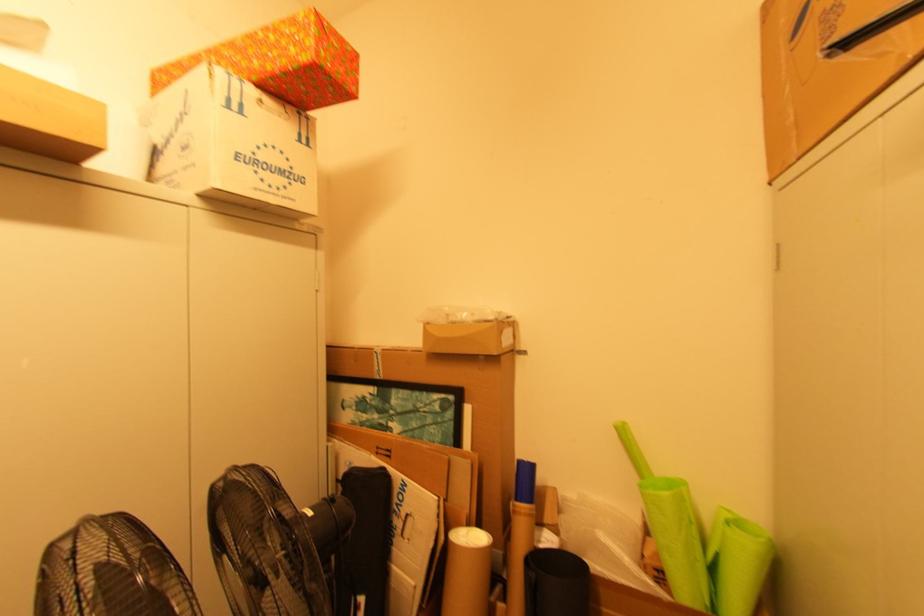
At what (x,y) coordinates should I click in order to perform the action: click on brown cardboard tube. Please return your answer as a coordinate pair (x, y). Looking at the image, I should click on (467, 572).